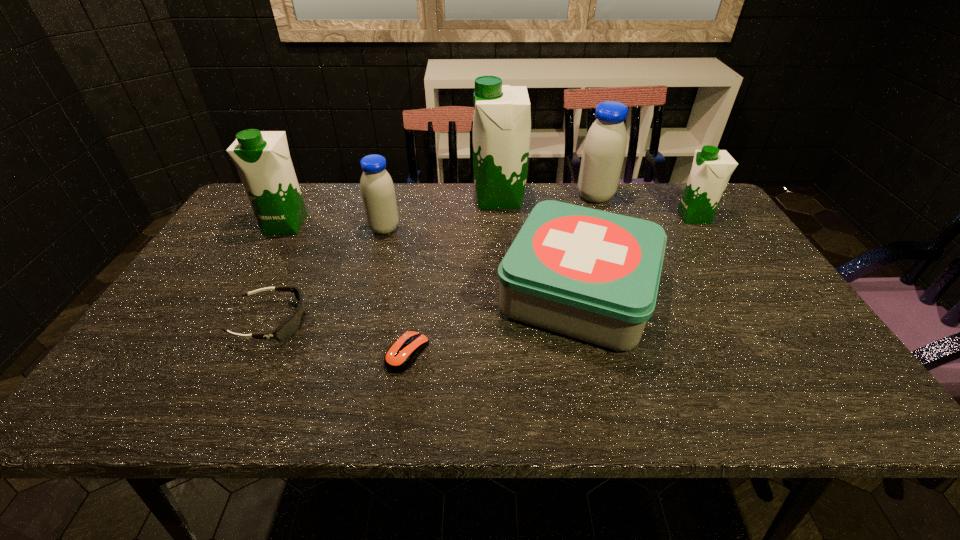
This screenshot has height=540, width=960. I want to click on vacant space positioned 0.350m on the front-facing side of the smallest green soya milk, so click(564, 217).

The image size is (960, 540). What are the coordinates of `vacant area situated 0.340m on the front-facing side of the smallest green soya milk` in the screenshot? It's located at (567, 217).

The image size is (960, 540). What are the coordinates of `free spot located 0.170m on the front-facing side of the smallest green soya milk` in the screenshot? It's located at (623, 217).

In order to click on free spot located on the front of the smaller blue soya milk in this screenshot , I will do coord(365,299).

Locate an element on the screen. free space located on the back of the teal first-aid kit is located at coordinates (556, 199).

You are a GUI agent. You are given a task and a screenshot of the screen. Output one action in this format:
    pyautogui.click(x=<x>, y=<y>)
    Task: Click on the vacant region located on the front and sides of the second shortest object
    The width and height of the screenshot is (960, 540).
    Given the screenshot: What is the action you would take?
    pyautogui.click(x=333, y=321)

At what (x,y) coordinates should I click in order to perform the action: click on free region located 0.230m on the back of the fourth object from left to right. Please return your answer as a coordinate pair (x, y). The width and height of the screenshot is (960, 540). Looking at the image, I should click on (420, 268).

The image size is (960, 540). I want to click on object situated at the left edge, so click(262, 158).

This screenshot has height=540, width=960. Identify the location of object present at the right edge. (711, 169).

Identify the location of object that is at the far left corner. The image size is (960, 540). (262, 158).